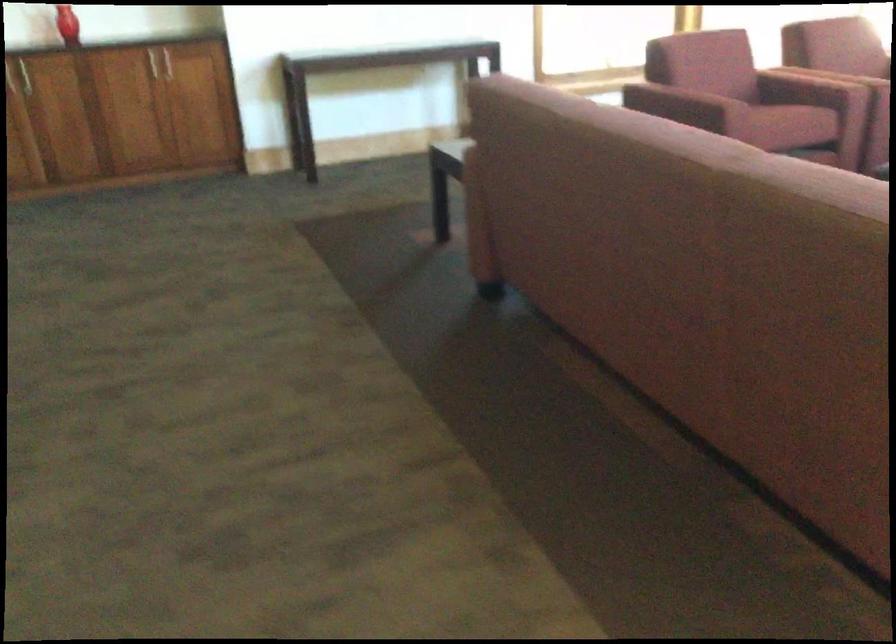
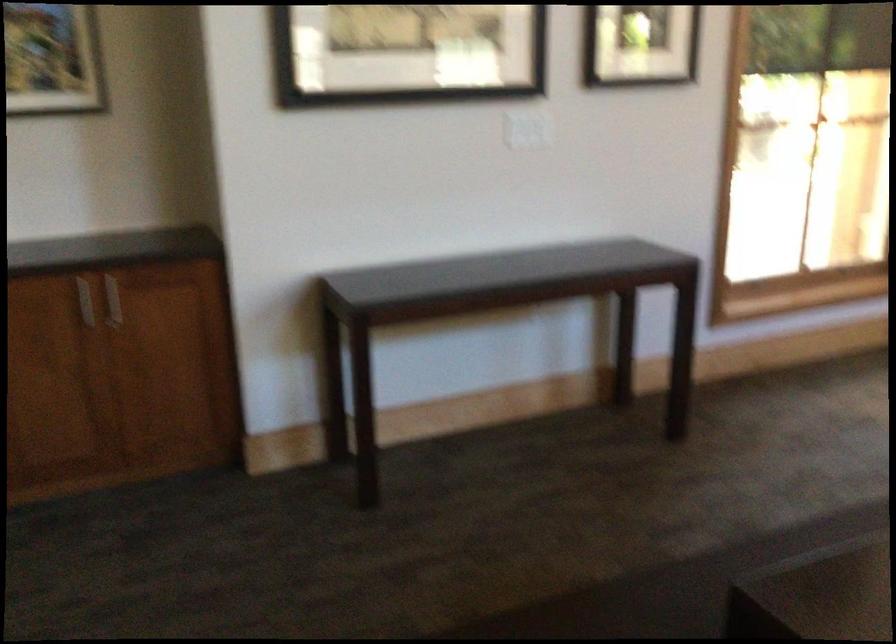
Question: Which direction would the cameraman need to move to produce the second image? Reply with the corresponding letter.

Choices:
 (A) Left
 (B) Right
 (C) Forward
 (D) Backward

Answer: (C)